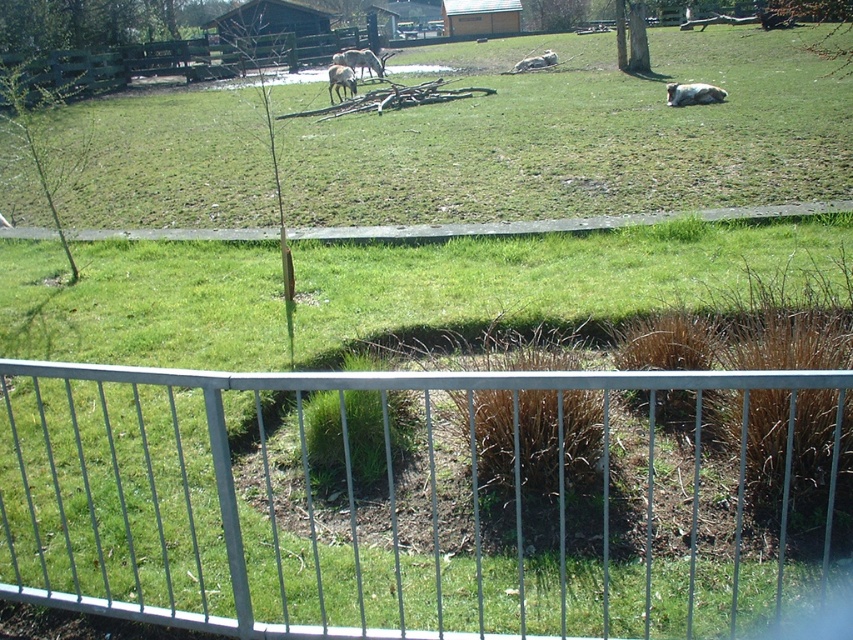
You are standing on a balcony with a metal railing and looking down at the white woolly sheep at upper center. If you drop a small apple straight down, will it land near the sheep?

The white woolly sheep at upper center is located at position point (693, 93), so if you drop the apple straight down from the balcony, it will land at the same x coordinate but lower y coordinate. Since the sheep is at upper center, dropping the apple straight down would land it near the sheep.

You are standing at the point marked by the coordinates point [422,499] in the image. Looking around, you see the silver metallic fence at lower center. What is the nearest object to you in this scene?

The nearest object to you at point [422,499] is the silver metallic fence at lower center because the coordinates directly indicate its location.